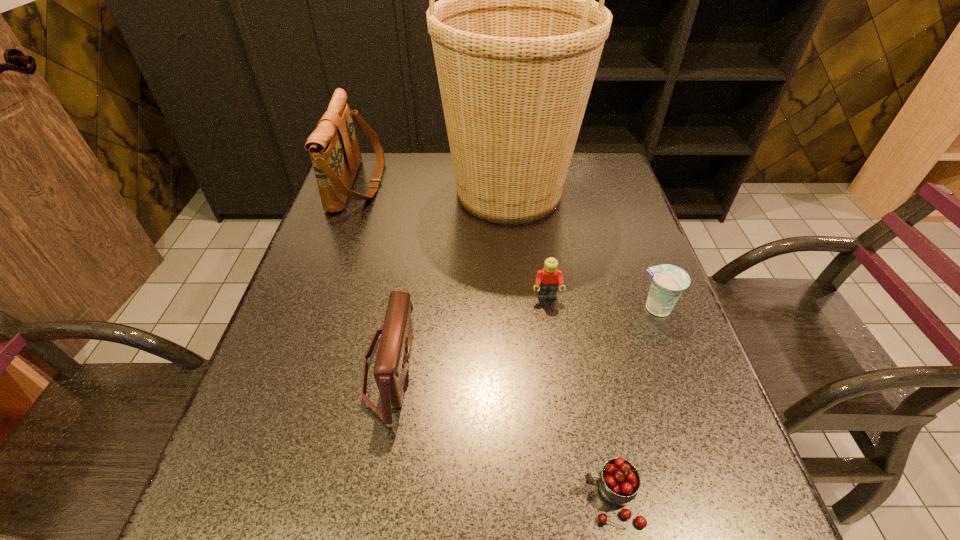
This screenshot has height=540, width=960. Find the location of `unoccupied position between the left shoulder bag and the Lego`. unoccupied position between the left shoulder bag and the Lego is located at coordinates (452, 240).

Locate an element on the screen. The height and width of the screenshot is (540, 960). unoccupied position between the shorter shoulder bag and the basket is located at coordinates (449, 280).

You are a GUI agent. You are given a task and a screenshot of the screen. Output one action in this format:
    pyautogui.click(x=<x>, y=<y>)
    Task: Click on the vacant area that lies between the rightmost object and the cherry
    The width and height of the screenshot is (960, 540).
    Given the screenshot: What is the action you would take?
    pyautogui.click(x=634, y=403)

This screenshot has height=540, width=960. I want to click on vacant region between the right shoulder bag and the leftmost object, so click(x=374, y=275).

At what (x,y) coordinates should I click in order to perform the action: click on vacant area that lies between the shorter shoulder bag and the yogurt. Please return your answer as a coordinate pair (x, y). Looking at the image, I should click on (523, 338).

Image resolution: width=960 pixels, height=540 pixels. In order to click on empty location between the yogurt and the Lego in this screenshot , I will do `click(602, 302)`.

Locate an element on the screen. The image size is (960, 540). vacant space that's between the left shoulder bag and the tallest object is located at coordinates (434, 187).

Locate an element on the screen. This screenshot has height=540, width=960. free point between the second object from left to right and the nearest object is located at coordinates (501, 433).

Identify the location of vacant area that lies between the left shoulder bag and the basket. (434, 187).

Select which object appears as the closest to the farther shoulder bag. Please provide its 2D coordinates. Your answer should be formatted as a tuple, i.e. [(x, y)], where the tuple contains the x and y coordinates of a point satisfying the conditions above.

[(517, 37)]